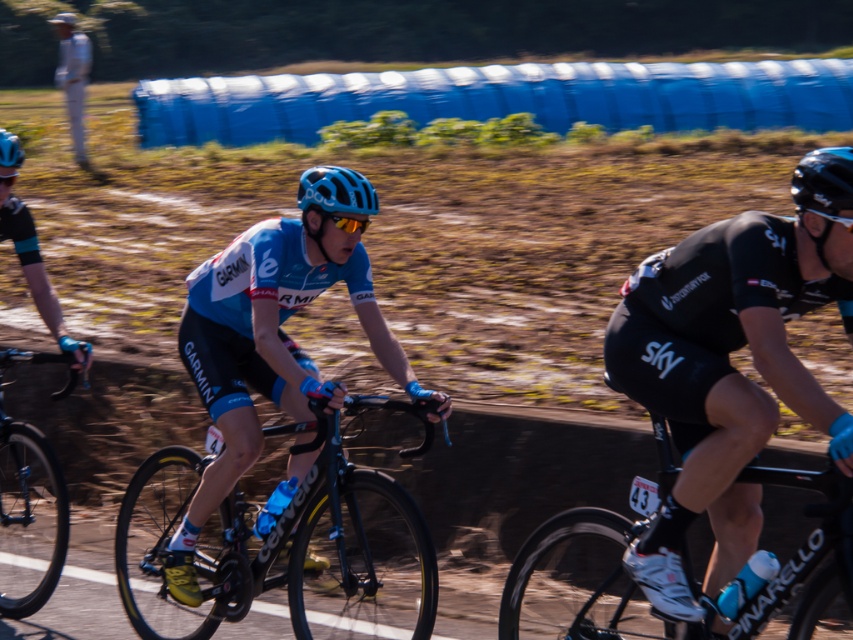
Question: Does shiny black frame at left have a larger size compared to blue matte helmet at center?

Choices:
 (A) yes
 (B) no

Answer: (A)

Question: Considering the real-world distances, which object is closest to the black matte bicycle at right?

Choices:
 (A) matte blue helmet at center
 (B) blue matte helmet at center

Answer: (B)

Question: Does black matte cycling jersey at right appear under matte blue helmet at center?

Choices:
 (A) yes
 (B) no

Answer: (A)

Question: Which object is farther from the camera taking this photo?

Choices:
 (A) blue matte helmet at center
 (B) black matte cycling jersey at right

Answer: (A)

Question: Which point appears closest to the camera in this image?

Choices:
 (A) pos(698,381)
 (B) pos(346,180)
 (C) pos(231,566)
 (D) pos(3,164)

Answer: (A)

Question: Where is matte blue cycling jersey at center located in relation to matte blue helmet at center in the image?

Choices:
 (A) right
 (B) left

Answer: (A)